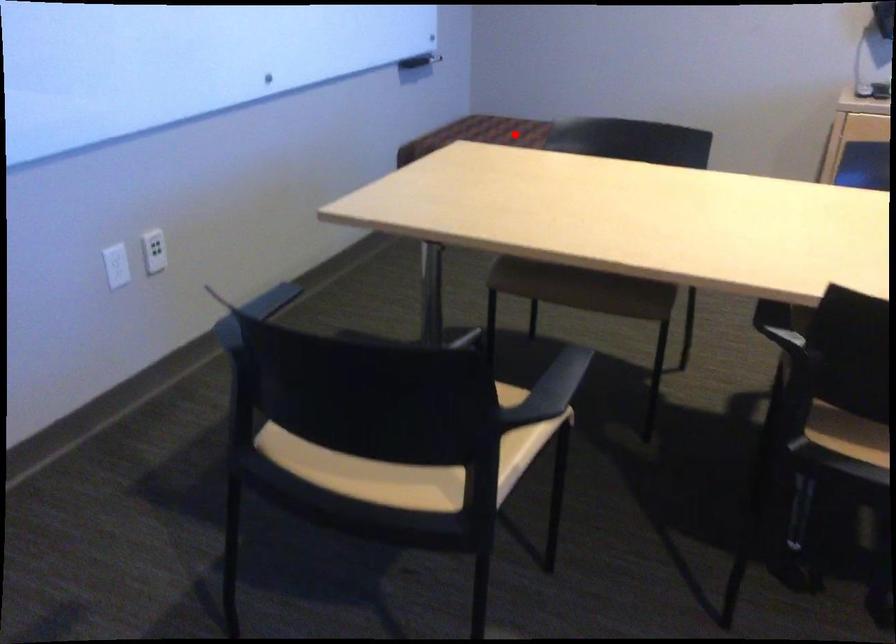
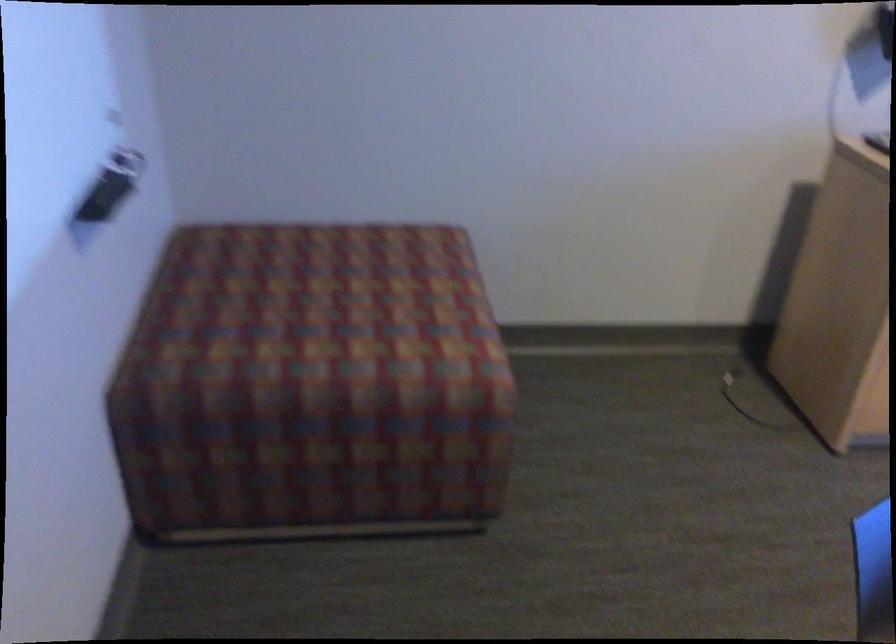
The point at the highlighted location is marked in the first image. Where is the corresponding point in the second image?

(332, 301)